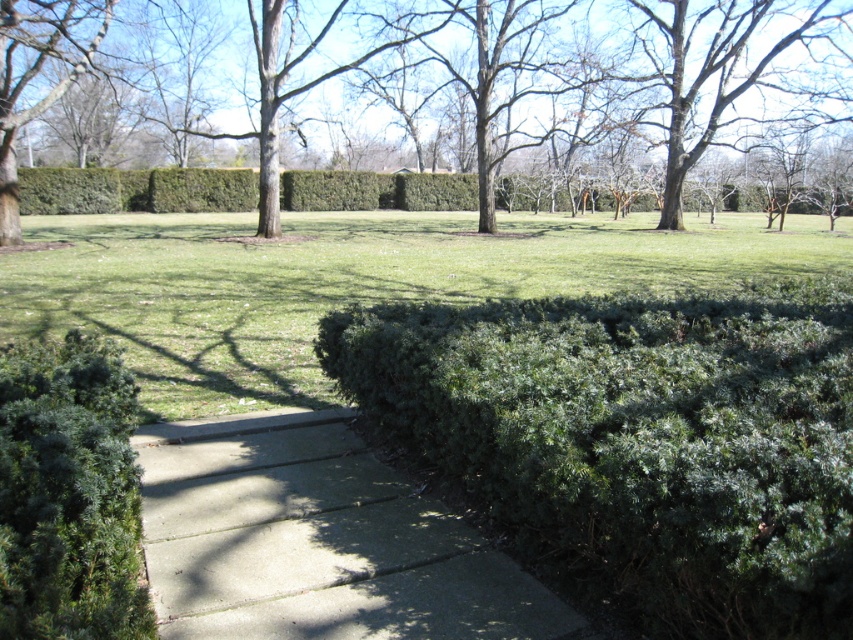
Question: Which point appears closest to the camera in this image?

Choices:
 (A) (42, 230)
 (B) (4, 360)

Answer: (B)

Question: Among these points, which one is nearest to the camera?

Choices:
 (A) (674, 220)
 (B) (107, 589)

Answer: (B)

Question: Does green leafy bush at lower center appear on the left side of green needle-like shrub at lower left?

Choices:
 (A) yes
 (B) no

Answer: (B)

Question: Is green leafy bush at center to the right of brown textured tree at upper center from the viewer's perspective?

Choices:
 (A) no
 (B) yes

Answer: (A)

Question: Among these objects, which one is nearest to the camera?

Choices:
 (A) brown textured tree at upper center
 (B) green leafy bush at center

Answer: (B)

Question: Is concrete at center wider than green needle-like shrub at lower left?

Choices:
 (A) no
 (B) yes

Answer: (B)